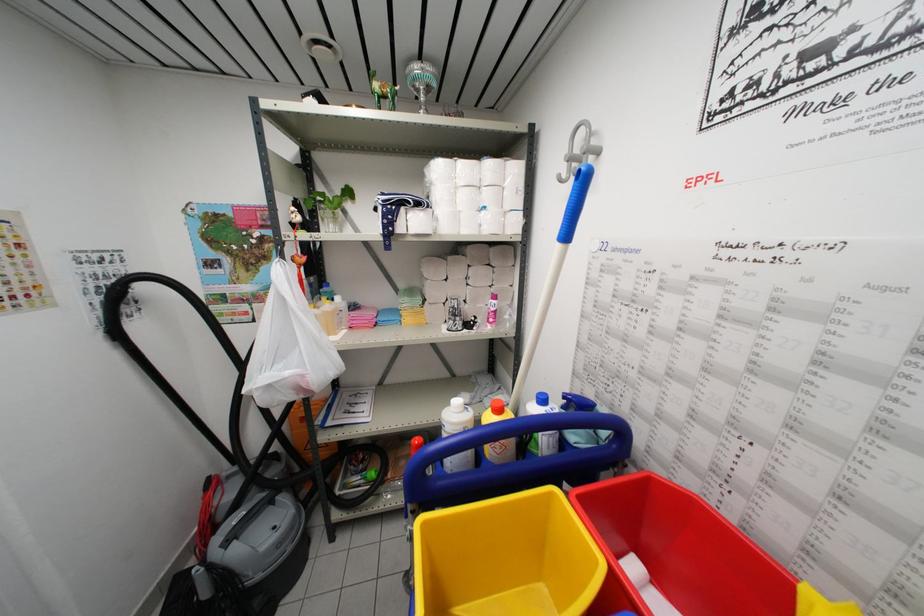
Find the location of a particular element. gray wall hook is located at coordinates (581, 143).